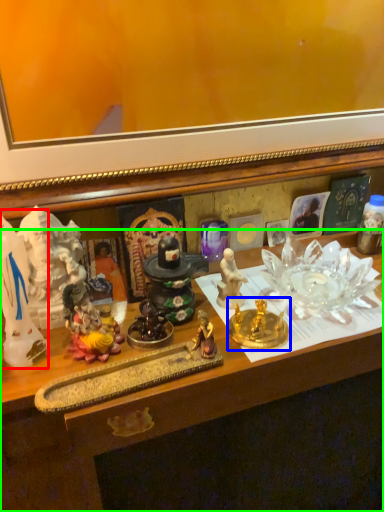
Question: Based on their relative distances, which object is farther from toy (highlighted by a red box)? Choose from candle holder (highlighted by a blue box) and desk (highlighted by a green box).

Choices:
 (A) candle holder
 (B) desk

Answer: (A)